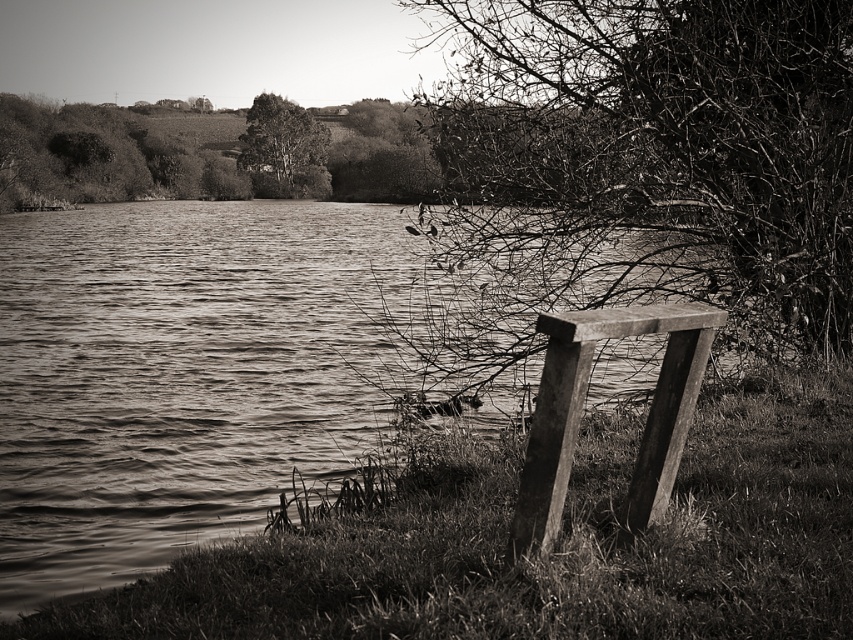
Question: Which point is closer to the camera?

Choices:
 (A) (296, 163)
 (B) (601, 268)
 (C) (554, 371)
 (D) (80, 445)

Answer: (C)

Question: Which point is farther to the camera?

Choices:
 (A) pos(833,275)
 (B) pos(28,298)

Answer: (B)

Question: Where is smooth water at lower left located in relation to smooth bark tree at right in the image?

Choices:
 (A) right
 (B) left

Answer: (B)

Question: Which object is farther from the camera taking this photo?

Choices:
 (A) smooth bark tree at upper center
 (B) wooden plank bench at right

Answer: (A)

Question: Can you confirm if smooth bark tree at right is positioned above smooth bark tree at upper center?

Choices:
 (A) yes
 (B) no

Answer: (B)

Question: Is the position of wooden plank bench at right more distant than that of smooth bark tree at upper center?

Choices:
 (A) yes
 (B) no

Answer: (B)